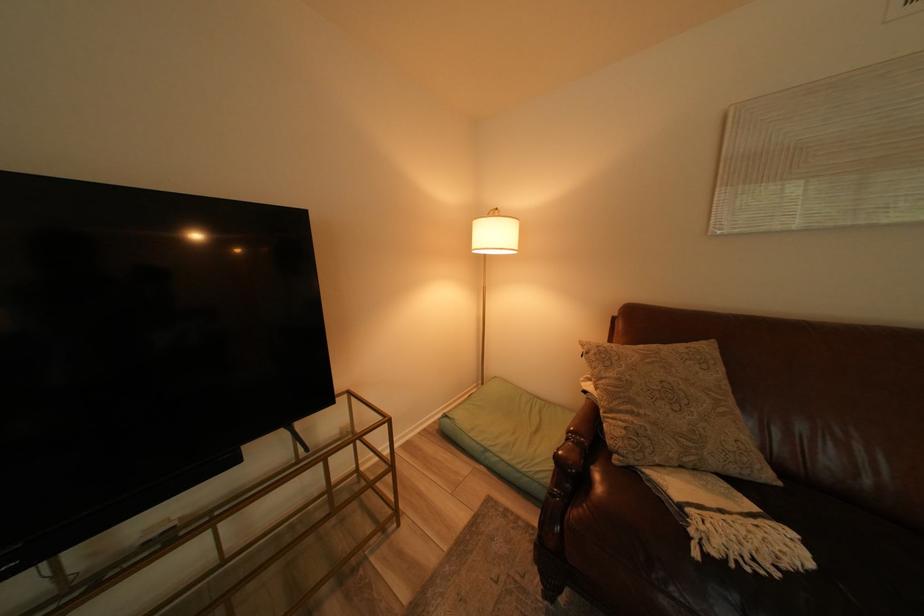
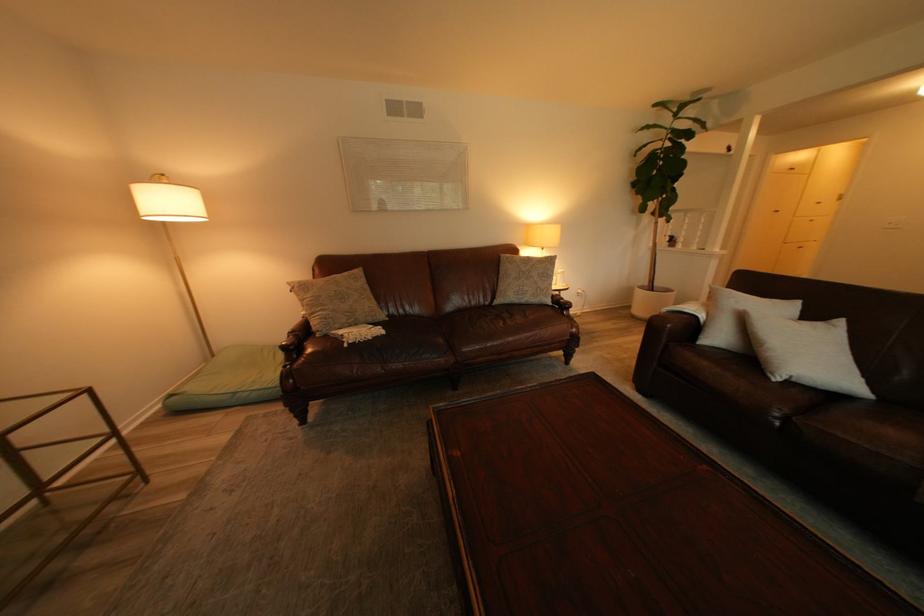
The point at (459,416) is marked in the first image. Where is the corresponding point in the second image?

(186, 395)